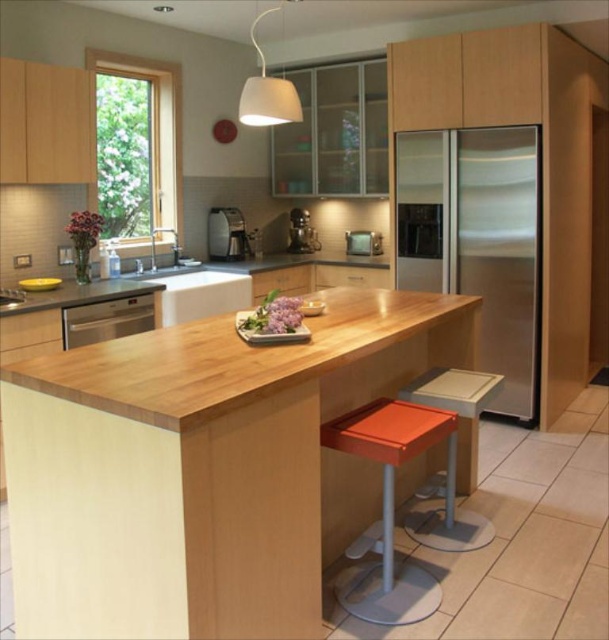
Does satin stainless steel dishwasher at left come in front of satin silver microwave at center?

Yes.

Is point (66, 330) positioned after point (381, 243)?

That is False.

Image resolution: width=609 pixels, height=640 pixels. In order to click on satin stainless steel dishwasher at left in this screenshot , I will do `click(107, 320)`.

Is orange matte bar stool at lower center to the right of satin silver coffee maker at center from the viewer's perspective?

Yes, orange matte bar stool at lower center is to the right of satin silver coffee maker at center.

Can you confirm if orange matte bar stool at lower center is positioned above satin silver coffee maker at center?

Actually, orange matte bar stool at lower center is below satin silver coffee maker at center.

You are a GUI agent. You are given a task and a screenshot of the screen. Output one action in this format:
    pyautogui.click(x=<x>, y=<y>)
    Task: Click on the orange matte bar stool at lower center
    The height and width of the screenshot is (640, 609).
    Given the screenshot: What is the action you would take?
    point(387,508)

Between point (99, 566) and point (392, 522), which one is positioned behind?

Positioned behind is point (392, 522).

Between light wood/texture counter top at center and orange matte bar stool at lower center, which one has less height?

With less height is orange matte bar stool at lower center.

Locate an element on the screen. light wood/texture counter top at center is located at coordinates (205, 467).

I want to click on light wood/texture counter top at center, so click(205, 467).